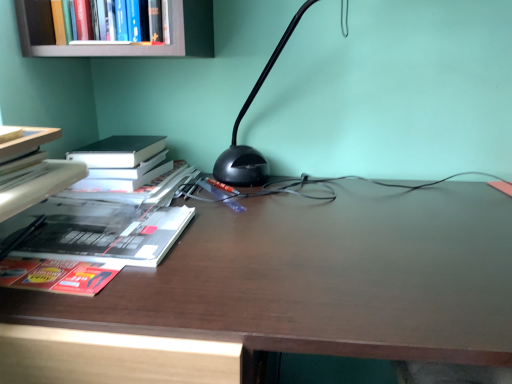
Question: Considering the relative sizes of hardcover book at upper left, the first book from the top, and dark wood desk at center in the image provided, is hardcover book at upper left, the first book from the top, taller than dark wood desk at center?

Choices:
 (A) yes
 (B) no

Answer: (B)

Question: Does hardcover book at upper left, the first book from the top, have a greater width compared to dark wood desk at center?

Choices:
 (A) yes
 (B) no

Answer: (B)

Question: Is hardcover book at upper left, the 3th book when ordered from bottom to top, to the left of dark wood desk at center from the viewer's perspective?

Choices:
 (A) yes
 (B) no

Answer: (A)

Question: Considering the relative positions of hardcover book at upper left, the 3th book when ordered from bottom to top, and dark wood desk at center in the image provided, is hardcover book at upper left, the 3th book when ordered from bottom to top, in front of dark wood desk at center?

Choices:
 (A) yes
 (B) no

Answer: (B)

Question: Does hardcover book at upper left, the 3th book when ordered from bottom to top, have a lesser height compared to dark wood desk at center?

Choices:
 (A) yes
 (B) no

Answer: (A)

Question: Is hardcover book at upper left, the 3th book when ordered from bottom to top, oriented away from dark wood desk at center?

Choices:
 (A) no
 (B) yes

Answer: (A)

Question: Considering the relative positions of hardcover book at left, placed as the first book when sorted from bottom to top, and dark wood desk at center in the image provided, is hardcover book at left, placed as the first book when sorted from bottom to top, to the left of dark wood desk at center from the viewer's perspective?

Choices:
 (A) no
 (B) yes

Answer: (B)

Question: Does hardcover book at left, placed as the first book when sorted from bottom to top, have a lesser height compared to dark wood desk at center?

Choices:
 (A) yes
 (B) no

Answer: (A)

Question: Considering the relative sizes of hardcover book at left, acting as the 3th book starting from the top, and dark wood desk at center in the image provided, is hardcover book at left, acting as the 3th book starting from the top, taller than dark wood desk at center?

Choices:
 (A) yes
 (B) no

Answer: (B)

Question: Is hardcover book at left, placed as the first book when sorted from bottom to top, aimed at dark wood desk at center?

Choices:
 (A) no
 (B) yes

Answer: (B)

Question: Is hardcover book at left, acting as the 3th book starting from the top, wider than dark wood desk at center?

Choices:
 (A) yes
 (B) no

Answer: (B)

Question: Considering the relative positions of hardcover book at left, placed as the first book when sorted from bottom to top, and dark wood desk at center in the image provided, is hardcover book at left, placed as the first book when sorted from bottom to top, behind dark wood desk at center?

Choices:
 (A) yes
 (B) no

Answer: (A)

Question: Is hardcover book at left, placed as the first book when sorted from bottom to top, in contact with black plastic lamp at center?

Choices:
 (A) yes
 (B) no

Answer: (B)